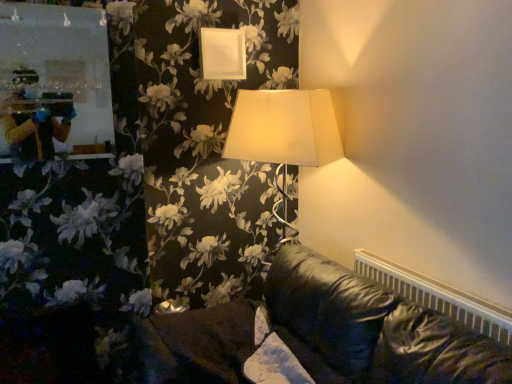
Question: Would you say white matte picture frame at upper center is a long distance from white plastic radiator at lower right?

Choices:
 (A) no
 (B) yes

Answer: (B)

Question: Is white matte picture frame at upper center taller than white plastic radiator at lower right?

Choices:
 (A) no
 (B) yes

Answer: (B)

Question: Can white plastic radiator at lower right be found inside white matte picture frame at upper center?

Choices:
 (A) yes
 (B) no

Answer: (B)

Question: Considering the relative positions of white matte picture frame at upper center and white plastic radiator at lower right in the image provided, is white matte picture frame at upper center in front of white plastic radiator at lower right?

Choices:
 (A) yes
 (B) no

Answer: (B)

Question: Can you confirm if white matte picture frame at upper center is smaller than white plastic radiator at lower right?

Choices:
 (A) yes
 (B) no

Answer: (A)

Question: From a real-world perspective, is white matte picture frame at upper center under white plastic radiator at lower right?

Choices:
 (A) yes
 (B) no

Answer: (B)

Question: Does white plastic radiator at lower right contain white matte picture frame at upper center?

Choices:
 (A) no
 (B) yes

Answer: (A)

Question: Is white plastic radiator at lower right shorter than white matte picture frame at upper center?

Choices:
 (A) yes
 (B) no

Answer: (A)

Question: Can you confirm if white plastic radiator at lower right is wider than white matte picture frame at upper center?

Choices:
 (A) no
 (B) yes

Answer: (B)

Question: Is white plastic radiator at lower right looking in the opposite direction of white matte picture frame at upper center?

Choices:
 (A) yes
 (B) no

Answer: (B)

Question: Is white plastic radiator at lower right at the right side of white matte picture frame at upper center?

Choices:
 (A) yes
 (B) no

Answer: (A)

Question: Does white plastic radiator at lower right have a greater height compared to white matte picture frame at upper center?

Choices:
 (A) no
 (B) yes

Answer: (A)

Question: Considering the positions of white matte picture frame at upper center and white plastic radiator at lower right in the image, is white matte picture frame at upper center wider or thinner than white plastic radiator at lower right?

Choices:
 (A) wide
 (B) thin

Answer: (B)